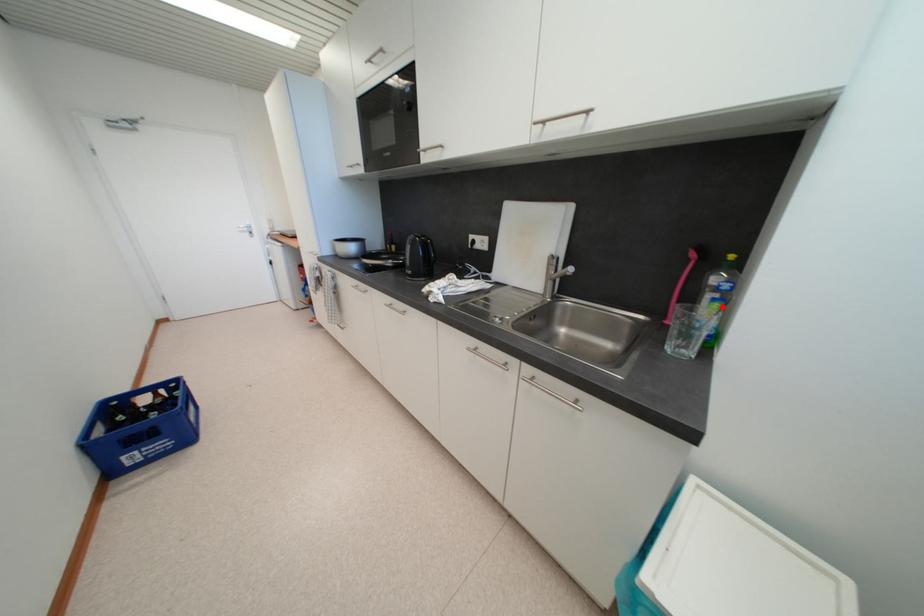
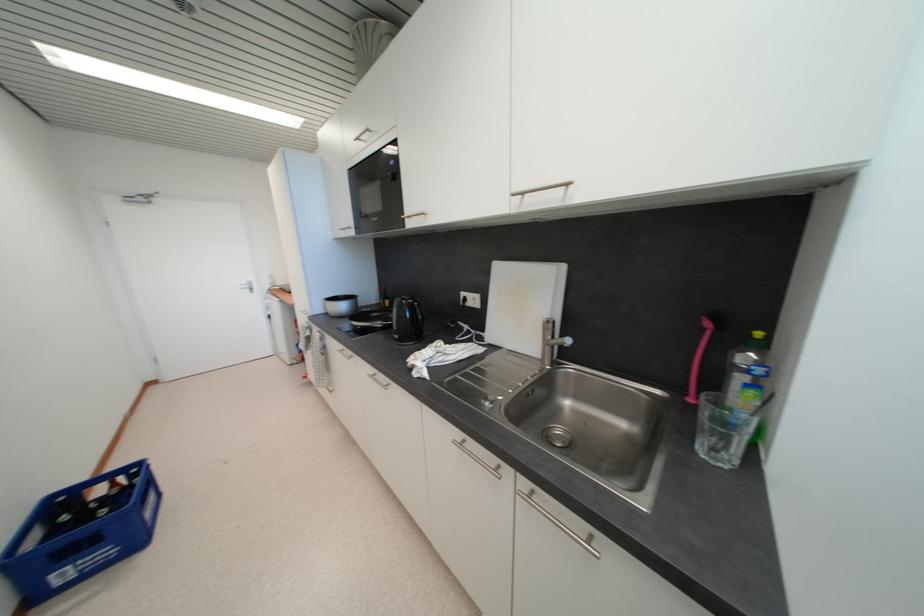
In the second image, find the point that corresponds to the highlighted location in the first image.

(757, 394)